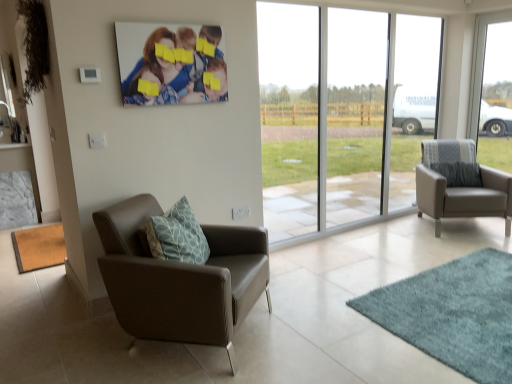
The image size is (512, 384). I want to click on unoccupied area in front of transparent glass window at center, which appears as the first window when viewed from the left, so [x=389, y=279].